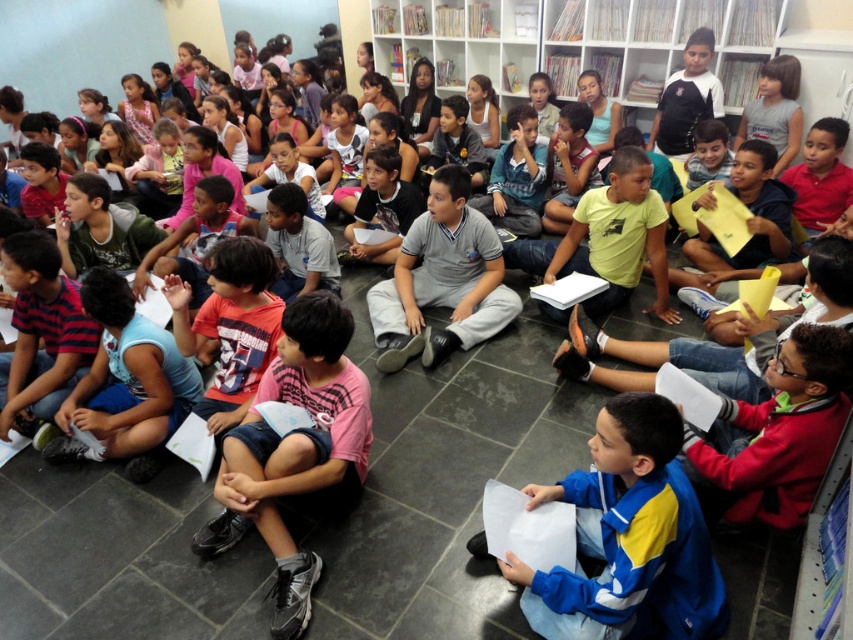
You are a new student entering the library and see the white glossy bookshelf at upper center and the gray cotton shirt at center. Which object is higher up in the image?

The white glossy bookshelf at upper center is positioned over the gray cotton shirt at center, so it is higher up in the image.

You are a photographer standing in the library. You want to take a photo of the gray cotton shirt at center without the white glossy bookshelf at upper center blocking the view. Is it possible to adjust your position to achieve this?

The gray cotton shirt at center is behind the white glossy bookshelf at upper center, so moving your position might not help as the shirt is already obscured by the bookshelf. You might need to move the bookshelf or the shirt to get an unobstructed view.